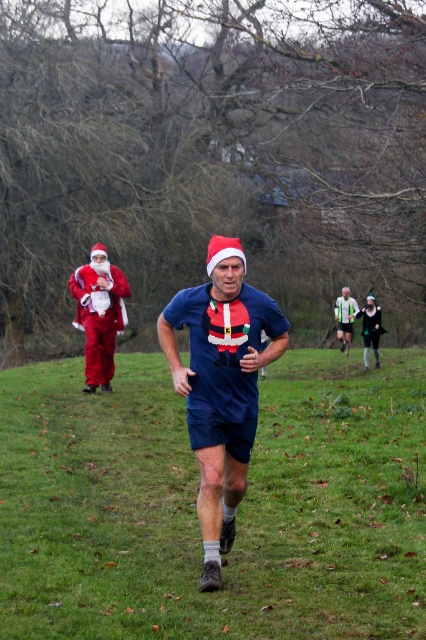
You are a photographer standing at the starting line of the race. You want to take a photo that includes both the point at coordinates point (89, 328) and point (354, 300). Which point should you focus on first to ensure both are in focus?

You should focus on point (354, 300) first because it is farther from the camera than point (89, 328). By focusing on the farther point, the closer point will also be within the depth of field, ensuring both are in focus.